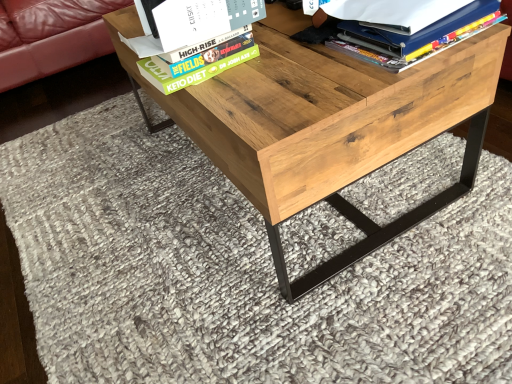
Question: Considering the relative sizes of hardcover book at upper center and natural wood table at center in the image provided, is hardcover book at upper center smaller than natural wood table at center?

Choices:
 (A) yes
 (B) no

Answer: (A)

Question: Is the depth of hardcover book at upper center less than that of natural wood table at center?

Choices:
 (A) yes
 (B) no

Answer: (B)

Question: Is hardcover book at upper center beside natural wood table at center?

Choices:
 (A) yes
 (B) no

Answer: (B)

Question: Considering the relative sizes of hardcover book at upper center and natural wood table at center in the image provided, is hardcover book at upper center thinner than natural wood table at center?

Choices:
 (A) no
 (B) yes

Answer: (B)

Question: Is hardcover book at upper center taller than natural wood table at center?

Choices:
 (A) yes
 (B) no

Answer: (B)

Question: From a real-world perspective, is matte blue folder at upper right above or below natural wood table at center?

Choices:
 (A) below
 (B) above

Answer: (B)

Question: From the image's perspective, is matte blue folder at upper right positioned above or below natural wood table at center?

Choices:
 (A) below
 (B) above

Answer: (B)

Question: In terms of size, does matte blue folder at upper right appear bigger or smaller than natural wood table at center?

Choices:
 (A) small
 (B) big

Answer: (A)

Question: Considering the positions of point (460, 18) and point (464, 168), is point (460, 18) closer or farther from the camera than point (464, 168)?

Choices:
 (A) farther
 (B) closer

Answer: (B)

Question: From a real-world perspective, relative to natural wood table at center, is hardcover book at upper center vertically above or below?

Choices:
 (A) below
 (B) above

Answer: (B)

Question: Looking at their shapes, would you say hardcover book at upper center is wider or thinner than natural wood table at center?

Choices:
 (A) thin
 (B) wide

Answer: (A)

Question: Based on their sizes in the image, would you say hardcover book at upper center is bigger or smaller than natural wood table at center?

Choices:
 (A) small
 (B) big

Answer: (A)

Question: Is point (143, 72) closer or farther from the camera than point (331, 183)?

Choices:
 (A) closer
 (B) farther

Answer: (B)

Question: Is point (163, 77) positioned closer to the camera than point (410, 49)?

Choices:
 (A) farther
 (B) closer

Answer: (A)

Question: Relative to matte blue folder at upper right, is hardcover book at upper center in front or behind?

Choices:
 (A) front
 (B) behind

Answer: (B)